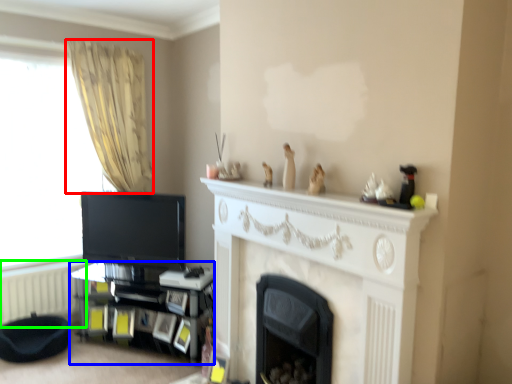
Question: Considering the real-world distances, which object is closest to curtain (highlighted by a red box)? shelf (highlighted by a blue box) or radiator (highlighted by a green box).

Choices:
 (A) shelf
 (B) radiator

Answer: (A)